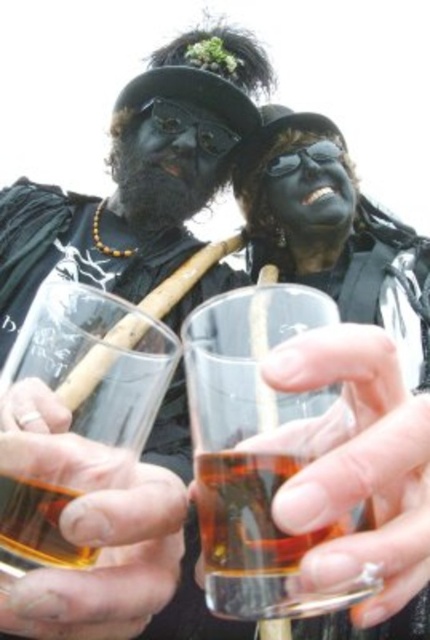
You are observing two points in the image. The first point is at coordinates point (392, 600) and the second is at point (52, 326). Which of these points is nearer to the viewer?

Point (392, 600) is closer to the camera than point (52, 326).